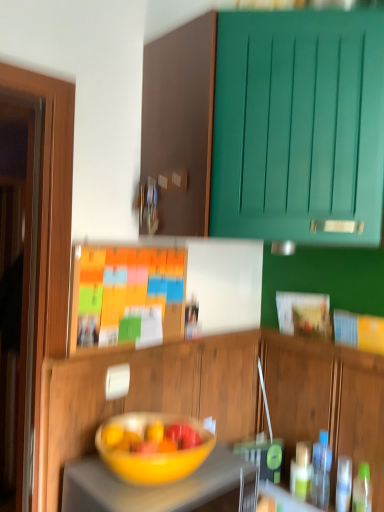
Identify the location of empty space that is ontop of wooden cabinet at center, which is the 2th cabinetry in top-to-bottom order (from a real-world perspective). This screenshot has height=512, width=384. (160, 337).